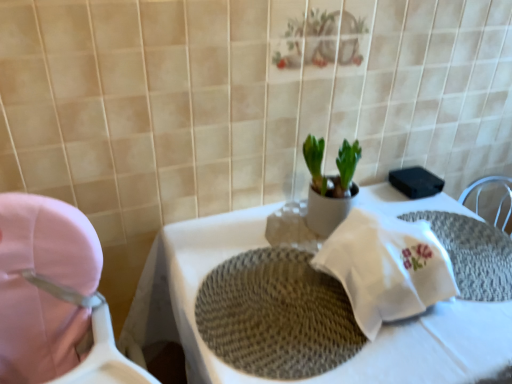
Question: Is woven beige placemat at center at the right side of white woven placemat at center?

Choices:
 (A) no
 (B) yes

Answer: (A)

Question: Is woven beige placemat at center positioned far away from white woven placemat at center?

Choices:
 (A) yes
 (B) no

Answer: (B)

Question: From the image's perspective, is woven beige placemat at center above white woven placemat at center?

Choices:
 (A) no
 (B) yes

Answer: (A)

Question: Can you confirm if woven beige placemat at center is bigger than white woven placemat at center?

Choices:
 (A) no
 (B) yes

Answer: (A)

Question: Does woven beige placemat at center have a greater width compared to white woven placemat at center?

Choices:
 (A) no
 (B) yes

Answer: (B)

Question: Looking at the image, does woven beige placemat at center seem bigger or smaller compared to white woven placemat at center?

Choices:
 (A) small
 (B) big

Answer: (A)

Question: Is woven beige placemat at center wider or thinner than white woven placemat at center?

Choices:
 (A) thin
 (B) wide

Answer: (B)

Question: In the image, is woven beige placemat at center on the left side or the right side of white woven placemat at center?

Choices:
 (A) left
 (B) right

Answer: (A)

Question: From a real-world perspective, is woven beige placemat at center above or below white woven placemat at center?

Choices:
 (A) below
 (B) above

Answer: (A)

Question: Considering the positions of pink fabric baby carriage at left and white woven placemat at center in the image, is pink fabric baby carriage at left wider or thinner than white woven placemat at center?

Choices:
 (A) thin
 (B) wide

Answer: (A)

Question: From the image's perspective, is pink fabric baby carriage at left located above or below white woven placemat at center?

Choices:
 (A) above
 (B) below

Answer: (B)

Question: Would you say pink fabric baby carriage at left is to the left or to the right of white woven placemat at center in the picture?

Choices:
 (A) right
 (B) left

Answer: (B)

Question: From a real-world perspective, is pink fabric baby carriage at left physically located above or below white woven placemat at center?

Choices:
 (A) above
 (B) below

Answer: (A)

Question: Is woven beige placemat at center to the left or to the right of white woven placemat at center in the image?

Choices:
 (A) right
 (B) left

Answer: (B)

Question: Is point [301, 263] positioned closer to the camera than point [172, 332]?

Choices:
 (A) closer
 (B) farther

Answer: (A)